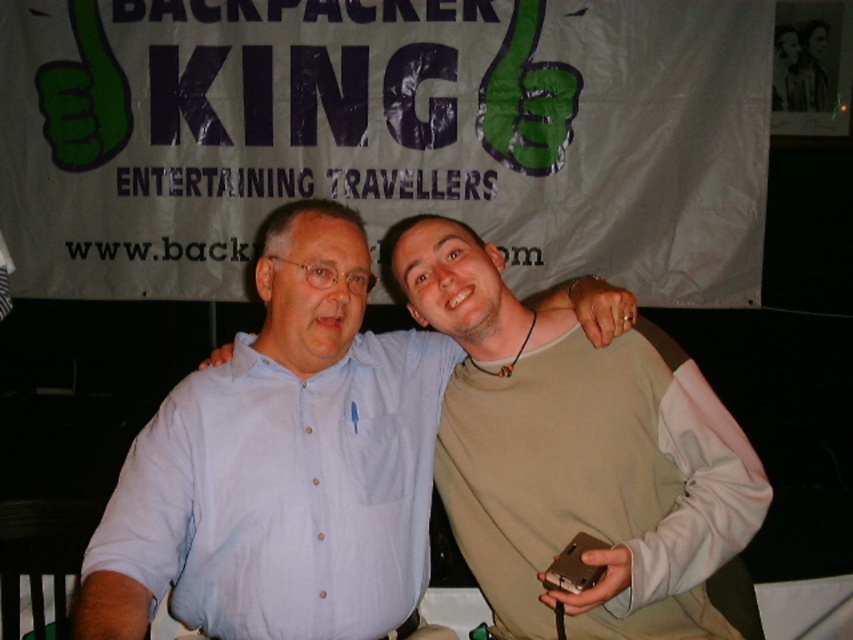
You are a photographer needing to take a clear photo of the beige fabric shirt at center. The camera you have requires a minimum distance of 1.5 meters to avoid blurring. Can you take the photo from your current position?

The beige fabric shirt at center and camera are 1.49 meters apart, which is less than the required 1.5 meters. Therefore, you cannot take a clear photo from your current position without blurring.

You are at the event and want to take a photo of both the beige fabric shirt at center and the light blue shirt at center. Since you can only focus on one shirt at a time, which one should you focus on to ensure the other is still somewhat in focus?

You should focus on the beige fabric shirt at center because it is closer to you than the light blue shirt at center, so focusing on the closer one will keep the farther one more in focus.